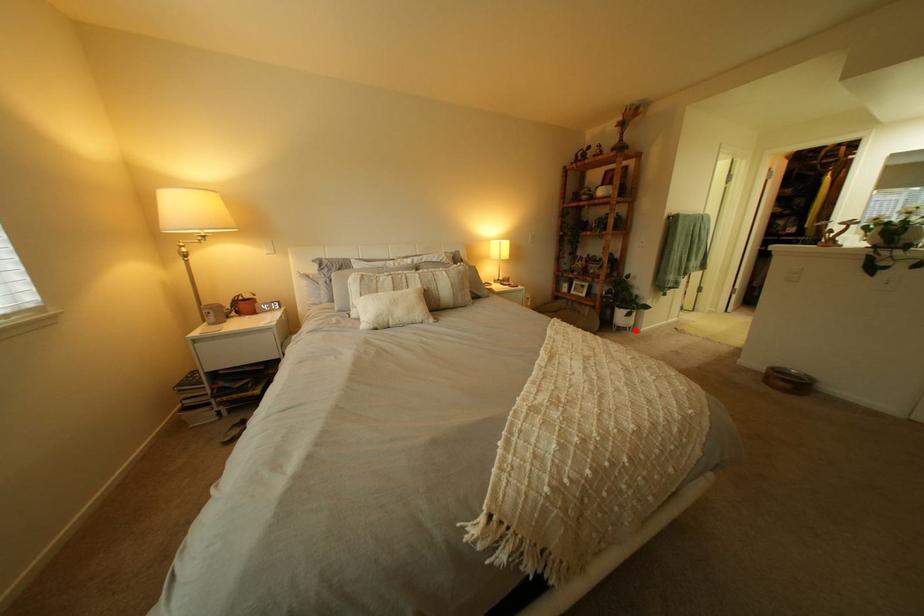
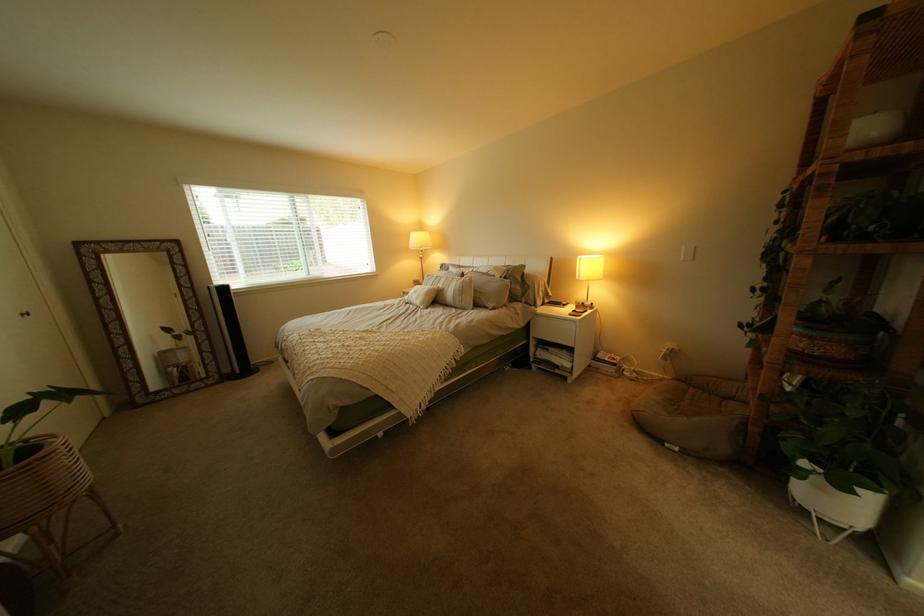
Where in the second image is the point corresponding to the highlighted location from the first image?

(821, 512)